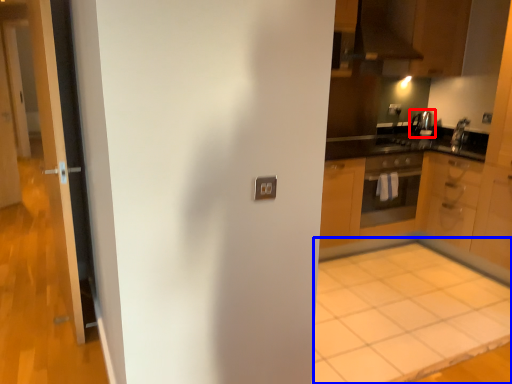
Question: Which of the following is the farthest to the observer, appliance (highlighted by a red box) or plain (highlighted by a blue box)?

Choices:
 (A) appliance
 (B) plain

Answer: (A)